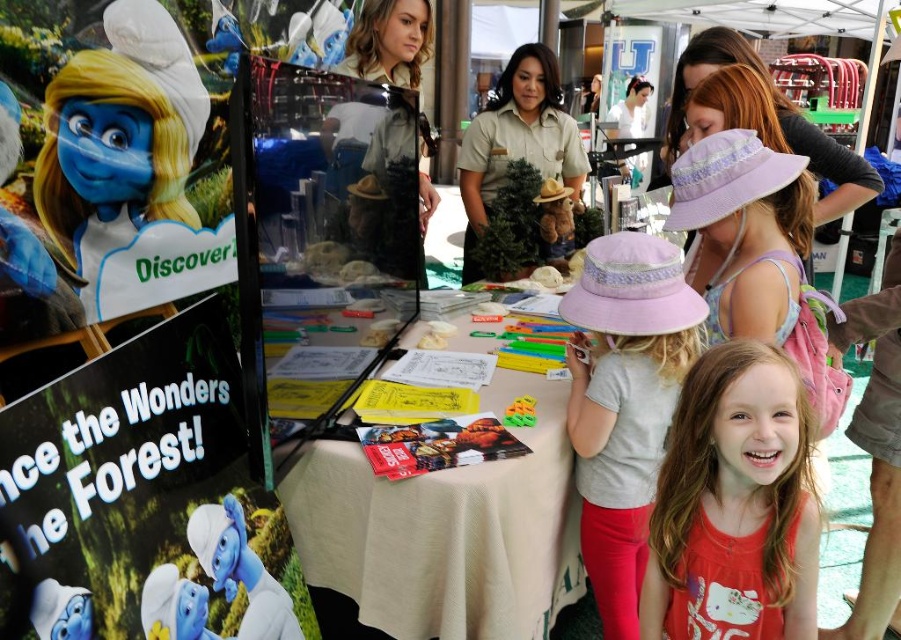
You are a visitor at the event and want to pick up the pink cotton shirt at lower right. Can you reach it without moving the matte paper poster at lower left?

The matte paper poster at lower left is closer to the viewer than the pink cotton shirt at lower right, so you would need to move the poster to access the shirt.

You are a visitor at the event and want to pick up a pamphlet from the white cloth table at center. However, there is a khaki uniform at center blocking your view. Can you see the table from where you are standing?

The white cloth table at center is shorter than the khaki uniform at center, so the khaki uniform at center would block your view of the table.

You are attending the fair and see the pink cotton shirt at lower right and the pink fabric hat at upper center on the table. Which item is positioned closer to the bottom edge of the table?

The pink cotton shirt at lower right is positioned closer to the bottom edge of the table because it is below the pink fabric hat at upper center.